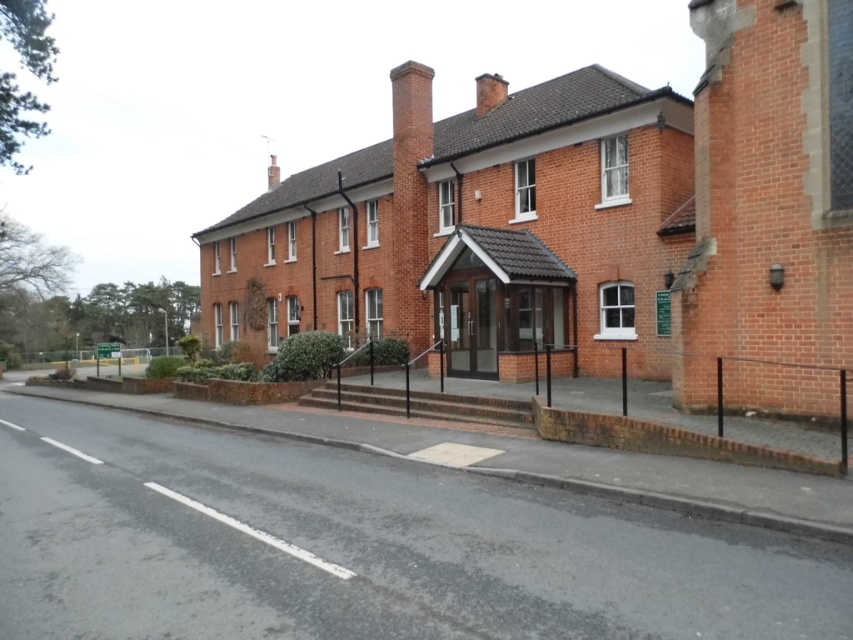
You are standing on the street looking at the brick building. You notice two chimneys on the roof. Which chimney, the red brick chimney at center or the brick chimney at upper center, is closer to you?

The red brick chimney at center is closer to you because it is in front of the brick chimney at upper center.

You are standing at the entrance of the building and want to locate the red brick chimney at center. Based on the coordinates provided, in which direction should you look to find it?

The red brick chimney at center is located at coordinates point [410,196], which is to the left of the entrance. You should look to your left to find it.

You are standing in front of the brick building and want to enter through the entrance. Which chimney, the red brick chimney at center or the brick chimney at upper center, is closer to the entrance?

The red brick chimney at center is closer to the entrance because it is positioned to the right of the brick chimney at upper center, placing it nearer to the entrance located at the front of the building.